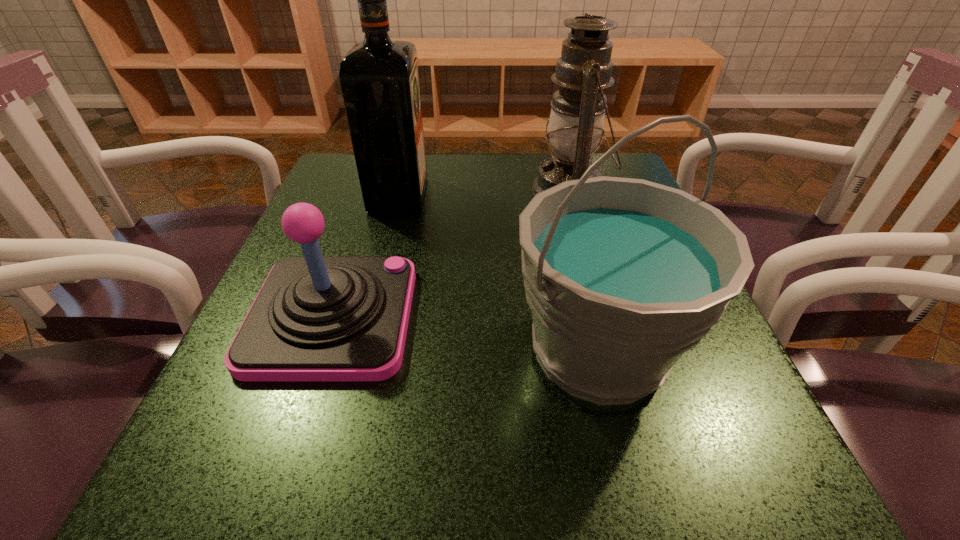
Identify the location of liquor present at the left edge. (379, 77).

Find the location of a particular element. joystick that is at the left edge is located at coordinates (315, 318).

You are a GUI agent. You are given a task and a screenshot of the screen. Output one action in this format:
    pyautogui.click(x=<x>, y=<y>)
    Task: Click on the oil lamp situated at the right edge
    
    Given the screenshot: What is the action you would take?
    pyautogui.click(x=576, y=122)

Where is `bucket that is at the right edge`? This screenshot has width=960, height=540. bucket that is at the right edge is located at coordinates click(x=623, y=276).

Identify the location of object located in the far left corner section of the desktop. (379, 77).

This screenshot has width=960, height=540. What are the coordinates of `object located in the far right corner section of the desktop` in the screenshot? It's located at (576, 122).

The height and width of the screenshot is (540, 960). In the image, there is a desktop. What are the coordinates of `vacant space at the far edge` in the screenshot? It's located at (458, 182).

Where is `vacant space at the near edge`? This screenshot has height=540, width=960. vacant space at the near edge is located at coordinates (372, 470).

I want to click on vacant region at the left edge of the desktop, so click(236, 385).

This screenshot has width=960, height=540. What are the coordinates of `vacant space at the far left corner of the desktop` in the screenshot? It's located at (348, 198).